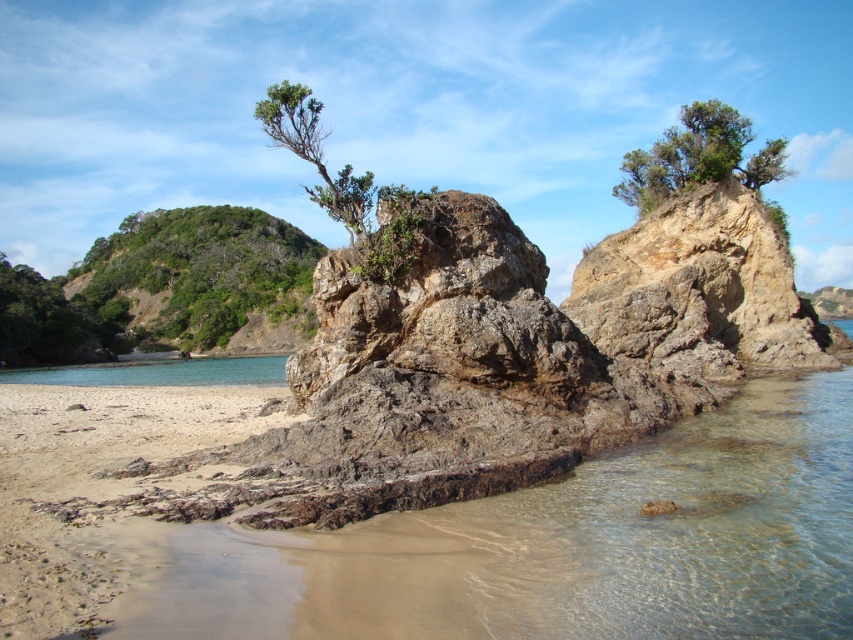
Is green leafy tree at upper left taller than green leafy tree at upper right?

No, green leafy tree at upper left is not taller than green leafy tree at upper right.

Does green leafy tree at upper left have a smaller size compared to green leafy tree at upper right?

Yes, green leafy tree at upper left is smaller than green leafy tree at upper right.

The image size is (853, 640). I want to click on green leafy tree at upper left, so click(x=195, y=273).

Which of these two, green leafy tree at upper left or green leafy shrub at upper center, stands taller?

Standing taller between the two is green leafy shrub at upper center.

What do you see at coordinates (195, 273) in the screenshot? I see `green leafy tree at upper left` at bounding box center [195, 273].

Which is in front, point (151, 275) or point (320, 108)?

Point (320, 108)

I want to click on green leafy tree at upper left, so click(195, 273).

Which of these two, green leafy tree at upper right or green leafy shrub at upper center, stands taller?

With more height is green leafy shrub at upper center.

Can you confirm if green leafy tree at upper right is wider than green leafy shrub at upper center?

Correct, the width of green leafy tree at upper right exceeds that of green leafy shrub at upper center.

In order to click on green leafy tree at upper right in this screenshot , I will do `click(698, 156)`.